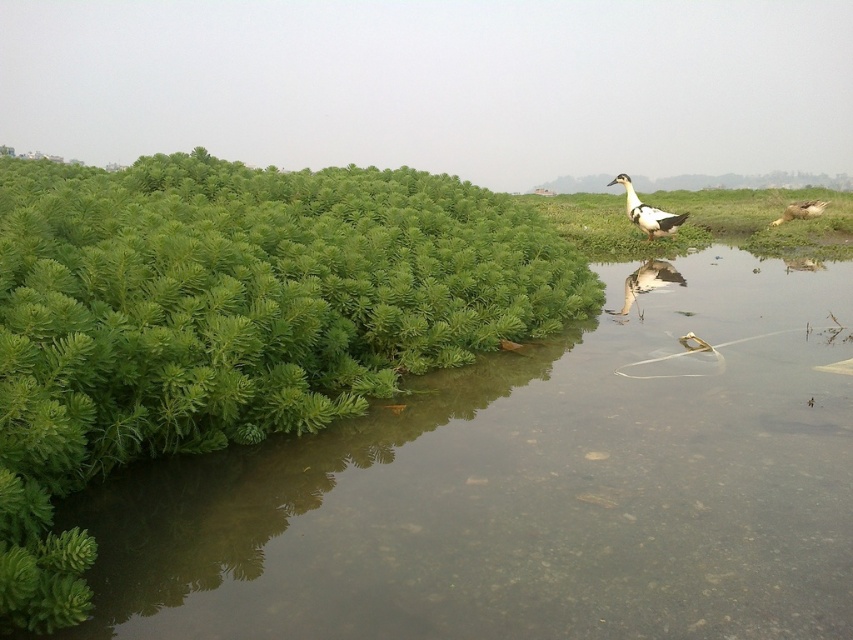
Question: Observing the image, what is the correct spatial positioning of white-feathered duck at upper right in reference to brown speckled feathers at right?

Choices:
 (A) above
 (B) below

Answer: (B)

Question: Based on their relative distances, which object is farther from the green leafy vegetation at lower left?

Choices:
 (A) brown speckled feathers at right
 (B) white-feathered duck at upper right

Answer: (A)

Question: Can you confirm if green leafy vegetation at lower left is positioned to the left of white glossy duck at center-right?

Choices:
 (A) no
 (B) yes

Answer: (B)

Question: Is green leafy vegetation at lower left thinner than brown speckled feathers at right?

Choices:
 (A) yes
 (B) no

Answer: (B)

Question: Which object appears closest to the camera in this image?

Choices:
 (A) white glossy duck at center-right
 (B) white-feathered duck at upper right

Answer: (A)

Question: Which point is farther to the camera?

Choices:
 (A) (799, 625)
 (B) (791, 204)

Answer: (B)